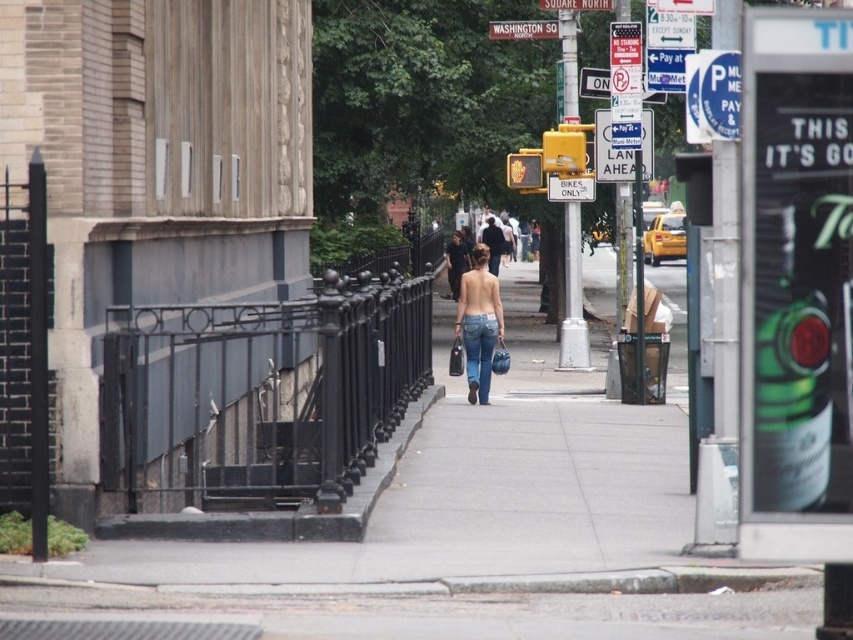
Who is positioned more to the right, dark brown leather jacket at center or white plastic street sign at upper center?

white plastic street sign at upper center

Is point (491, 220) farther from viewer compared to point (576, 3)?

That is True.

Where is `dark brown leather jacket at center`? This screenshot has height=640, width=853. dark brown leather jacket at center is located at coordinates (492, 244).

Consider the image. Between matte black tank top at center and white plastic street sign at upper center, which one is positioned lower?

matte black tank top at center is lower down.

Identify the location of matte black tank top at center. (456, 260).

Between red wooden sign at upper center and matte black tank top at center, which one has more height?

Standing taller between the two is matte black tank top at center.

Is red wooden sign at upper center to the left of matte black tank top at center from the viewer's perspective?

In fact, red wooden sign at upper center is to the right of matte black tank top at center.

Locate an element on the screen. Image resolution: width=853 pixels, height=640 pixels. red wooden sign at upper center is located at coordinates (523, 29).